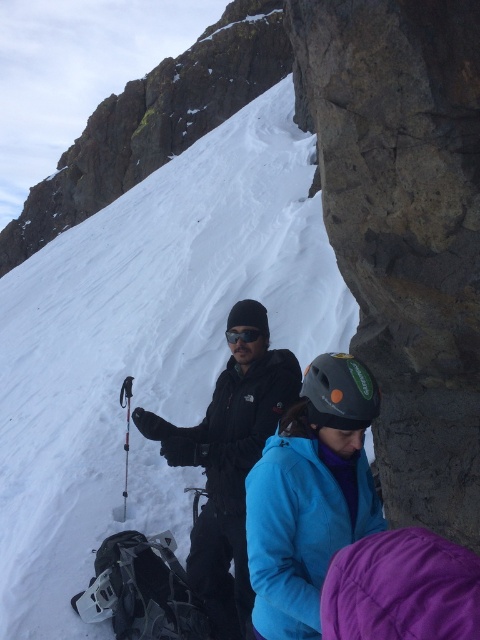
Question: Which object appears closest to the camera in this image?

Choices:
 (A) dark gray stone at right
 (B) white powder snow at center
 (C) black matte goggles at center
 (D) black matte jacket at center

Answer: (A)

Question: Does matte blue jacket at center lie in front of black matte goggles at center?

Choices:
 (A) yes
 (B) no

Answer: (A)

Question: Which of the following is the farthest from the observer?

Choices:
 (A) black matte jacket at center
 (B) matte blue jacket at center
 (C) white powder snow at center
 (D) dark gray stone at right

Answer: (C)

Question: Observing the image, what is the correct spatial positioning of dark gray stone at right in reference to matte blue jacket at center?

Choices:
 (A) left
 (B) right

Answer: (B)

Question: Is black matte jacket at center thinner than black matte goggles at center?

Choices:
 (A) no
 (B) yes

Answer: (A)

Question: Which object appears farthest from the camera in this image?

Choices:
 (A) white powder snow at center
 (B) black matte goggles at center
 (C) matte blue jacket at center

Answer: (A)